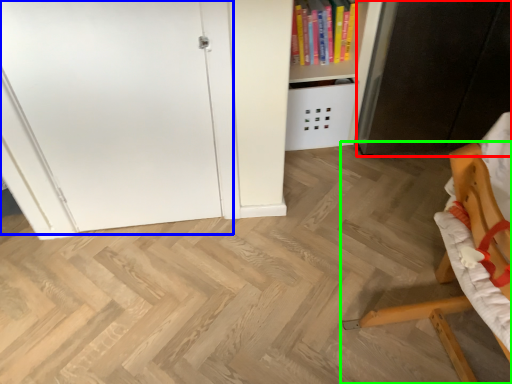
Question: Which is farther away from cabinetry (highlighted by a red box)? door (highlighted by a blue box) or furniture (highlighted by a green box)?

Choices:
 (A) door
 (B) furniture

Answer: (A)